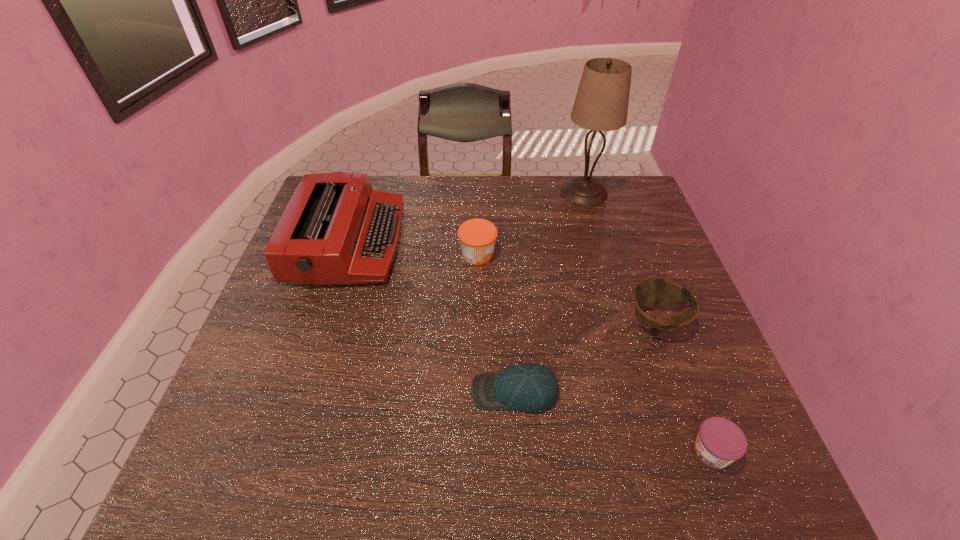
At what (x,y) coordinates should I click in order to perform the action: click on vacant space located on the typing side of the second tallest object. Please return your answer as a coordinate pair (x, y). This screenshot has width=960, height=540. Looking at the image, I should click on (470, 242).

Where is `free region located on the front label of the farther jam`? This screenshot has width=960, height=540. free region located on the front label of the farther jam is located at coordinates (635, 254).

Where is `vacant region located on the back of the bowl`? vacant region located on the back of the bowl is located at coordinates (624, 230).

This screenshot has width=960, height=540. What are the coordinates of `blank space located 0.070m on the right of the second nearest object` in the screenshot? It's located at (592, 392).

Where is `vacant space located on the front label of the nearest object`? vacant space located on the front label of the nearest object is located at coordinates (589, 452).

You are a GUI agent. You are given a task and a screenshot of the screen. Output one action in this format:
    pyautogui.click(x=<x>, y=<y>)
    Task: Click on the vacant point located on the front label of the nearest object
    The height and width of the screenshot is (540, 960).
    Given the screenshot: What is the action you would take?
    pyautogui.click(x=615, y=452)

This screenshot has height=540, width=960. Find the location of `vacant region located on the front label of the nearest object`. vacant region located on the front label of the nearest object is located at coordinates (488, 452).

The image size is (960, 540). In order to click on lampshade that is at the far edge in this screenshot , I will do `click(601, 104)`.

The height and width of the screenshot is (540, 960). Identify the location of typewriter located in the far edge section of the desktop. (336, 229).

Identify the location of object that is at the near edge. The image size is (960, 540). (719, 442).